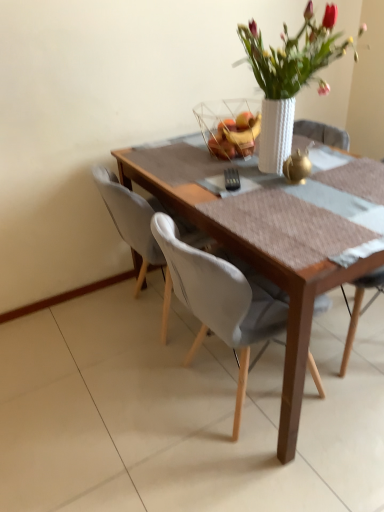
At what (x,y) coordinates should I click in order to perform the action: click on wooden table at center. Please return your answer as a coordinate pair (x, y). This screenshot has width=384, height=512. Looking at the image, I should click on (259, 247).

Image resolution: width=384 pixels, height=512 pixels. In order to click on translucent glass bowl at center in this screenshot , I will do `click(236, 136)`.

Locate an element on the screen. white fabric chair at center is located at coordinates (131, 220).

Looking at this image, considering the relative positions of translucent glass bowl at center and white fabric chair at center in the image provided, is translucent glass bowl at center to the left or to the right of white fabric chair at center?

translucent glass bowl at center is positioned on white fabric chair at center's right side.

Are translucent glass bowl at center and white fabric chair at center making contact?

No, translucent glass bowl at center is not touching white fabric chair at center.

Based on the photo, is white fabric chair at center located within translucent glass bowl at center?

No, white fabric chair at center is located outside of translucent glass bowl at center.

Based on the photo, from the image's perspective, is translucent glass bowl at center located beneath white fabric chair at center?

No.

Is white textured vase at upper center at the right side of white fabric chair at center?

Indeed, white textured vase at upper center is positioned on the right side of white fabric chair at center.

Is white textured vase at upper center positioned beyond the bounds of white fabric chair at center?

white textured vase at upper center lies outside white fabric chair at center's area.

Between white textured vase at upper center and white fabric chair at center, which one has smaller size?

With smaller size is white textured vase at upper center.

Considering the sizes of objects white textured vase at upper center and white fabric chair at center in the image provided, who is wider, white textured vase at upper center or white fabric chair at center?

white fabric chair at center is wider.

In the image, is white textured vase at upper center positioned in front of or behind wooden table at center?

white textured vase at upper center is behind wooden table at center.

Which point is more distant from viewer, (272,59) or (201,175)?

Answer: The point (201,175) is farther.

How different are the orientations of white textured vase at upper center and wooden table at center in degrees?

The angular difference between white textured vase at upper center and wooden table at center is 0.125 degrees.

In the scene shown: Is white fabric chair at center oriented away from translucent glass bowl at center?

No, white fabric chair at center's orientation is not away from translucent glass bowl at center.

Is white fabric chair at center to the left or to the right of translucent glass bowl at center in the image?

In the image, white fabric chair at center appears on the left side of translucent glass bowl at center.

Considering the positions of point (133, 249) and point (223, 153), is point (133, 249) closer or farther from the camera than point (223, 153)?

Point (133, 249).

In the scene shown: Between wooden table at center and white fabric chair at center, which one is positioned in front?

wooden table at center is in front.

Is wooden table at center inside the boundaries of white fabric chair at center, or outside?

wooden table at center is not enclosed by white fabric chair at center.

Which of these two, wooden table at center or white fabric chair at center, stands taller?

With more height is white fabric chair at center.

Is wooden table at center next to white fabric chair at center and touching it?

No, wooden table at center is not next to white fabric chair at center.

Considering the sizes of objects white textured vase at upper center and translucent glass bowl at center in the image provided, who is wider, white textured vase at upper center or translucent glass bowl at center?

white textured vase at upper center.

How many degrees apart are the facing directions of white textured vase at upper center and translucent glass bowl at center?

0.212 degrees.

From the image's perspective, does white textured vase at upper center appear lower than translucent glass bowl at center?

No, from the image's perspective, white textured vase at upper center is not beneath translucent glass bowl at center.

Considering the sizes of white textured vase at upper center and translucent glass bowl at center in the image, is white textured vase at upper center bigger or smaller than translucent glass bowl at center?

white textured vase at upper center is bigger than translucent glass bowl at center.

From the image's perspective, is translucent glass bowl at center under wooden table at center?

No, from the image's perspective, translucent glass bowl at center is not beneath wooden table at center.

Which of these two, translucent glass bowl at center or wooden table at center, is bigger?

Bigger between the two is wooden table at center.

Can you tell me how much translucent glass bowl at center and wooden table at center differ in facing direction?

There is a 0.338-degree angle between the facing directions of translucent glass bowl at center and wooden table at center.

Is translucent glass bowl at center inside the boundaries of wooden table at center, or outside?

translucent glass bowl at center is not enclosed by wooden table at center.

Find the location of a particular element. fruit above the white fabric chair at center (from a real-world perspective) is located at coordinates (236, 136).

The image size is (384, 512). Find the location of `chair below the white textured vase at upper center (from the image's perspective)`. chair below the white textured vase at upper center (from the image's perspective) is located at coordinates (131, 220).

Considering their positions, is wooden table at center positioned closer to white fabric chair at center than translucent glass bowl at center?

Based on the image, wooden table at center appears to be nearer to white fabric chair at center.

When comparing their distances from white fabric chair at center, does translucent glass bowl at center or wooden table at center seem closer?

wooden table at center is positioned closer to the anchor white fabric chair at center.

Looking at the image, which one is located further to white fabric chair at center, white textured vase at upper center or wooden table at center?

Among the two, white textured vase at upper center is located further to white fabric chair at center.

Which object lies further to the anchor point translucent glass bowl at center, white textured vase at upper center or wooden table at center?

wooden table at center.

Estimate the real-world distances between objects in this image. Which object is closer to translucent glass bowl at center, white fabric chair at center or wooden table at center?

wooden table at center is positioned closer to the anchor translucent glass bowl at center.

Considering their positions, is wooden table at center positioned further to white textured vase at upper center than translucent glass bowl at center?

wooden table at center is further to white textured vase at upper center.

Based on their spatial positions, is translucent glass bowl at center or white textured vase at upper center further from wooden table at center?

Based on the image, white textured vase at upper center appears to be further to wooden table at center.

When comparing their distances from white textured vase at upper center, does white fabric chair at center or wooden table at center seem closer?

Among the two, wooden table at center is located nearer to white textured vase at upper center.

At what (x,y) coordinates should I click in order to perform the action: click on chair between wooden table at center and translucent glass bowl at center from front to back. Please return your answer as a coordinate pair (x, y). The image size is (384, 512). Looking at the image, I should click on coord(131,220).

I want to click on houseplant between wooden table at center and translucent glass bowl at center in the front-back direction, so click(x=289, y=76).

At what (x,y) coordinates should I click in order to perform the action: click on fruit between white textured vase at upper center and white fabric chair at center vertically. Please return your answer as a coordinate pair (x, y). The width and height of the screenshot is (384, 512). Looking at the image, I should click on (236, 136).

I want to click on chair between white textured vase at upper center and wooden table at center from top to bottom, so click(x=131, y=220).